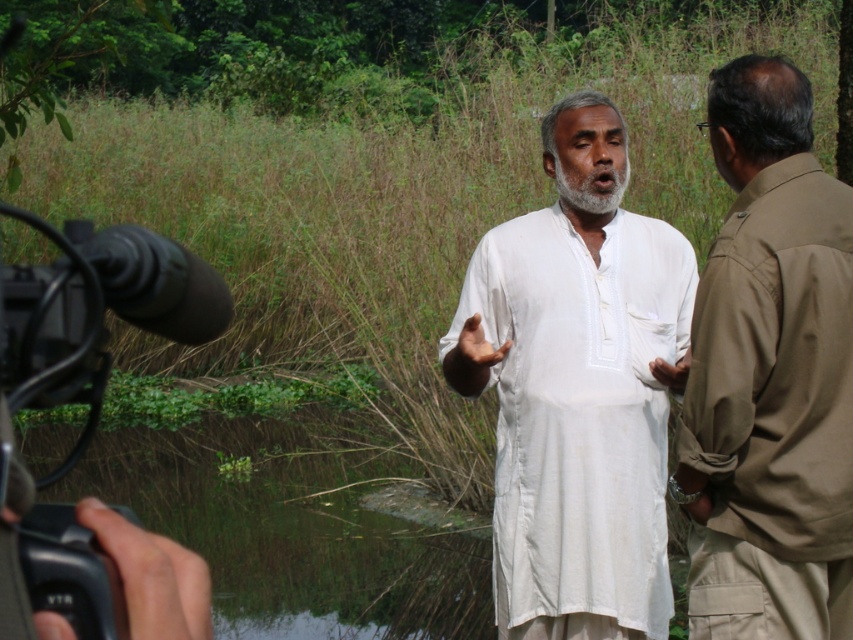
Question: Which point is farther to the camera?

Choices:
 (A) (798, 211)
 (B) (601, 150)

Answer: (B)

Question: Which is farther from the black plastic video camera at lower left?

Choices:
 (A) white cotton kurta at center
 (B) khaki cotton shirt at right

Answer: (A)

Question: Does white cotton kurta at center have a greater width compared to khaki cotton shirt at right?

Choices:
 (A) yes
 (B) no

Answer: (A)

Question: Which object is positioned farthest from the khaki cotton shirt at right?

Choices:
 (A) white cotton kurta at center
 (B) black plastic video camera at lower left

Answer: (B)

Question: Observing the image, what is the correct spatial positioning of khaki cotton shirt at right in reference to black plastic video camera at lower left?

Choices:
 (A) right
 (B) left

Answer: (A)

Question: Does white cotton kurta at center have a smaller size compared to black plastic video camera at lower left?

Choices:
 (A) no
 (B) yes

Answer: (A)